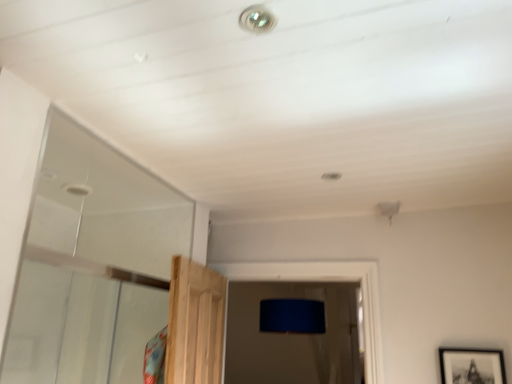
Question: In the image, is black matte picture frame at lower right on the left side or the right side of metallic droplight at upper center?

Choices:
 (A) right
 (B) left

Answer: (A)

Question: Does point (446, 349) appear closer or farther from the camera than point (272, 23)?

Choices:
 (A) farther
 (B) closer

Answer: (A)

Question: In terms of height, does black matte picture frame at lower right look taller or shorter compared to metallic droplight at upper center?

Choices:
 (A) tall
 (B) short

Answer: (A)

Question: Is point (x=251, y=26) positioned closer to the camera than point (x=480, y=382)?

Choices:
 (A) farther
 (B) closer

Answer: (B)

Question: From a real-world perspective, is metallic droplight at upper center positioned above or below black matte picture frame at lower right?

Choices:
 (A) above
 (B) below

Answer: (A)

Question: In the image, is metallic droplight at upper center on the left side or the right side of black matte picture frame at lower right?

Choices:
 (A) left
 (B) right

Answer: (A)

Question: Is metallic droplight at upper center in front of or behind black matte picture frame at lower right in the image?

Choices:
 (A) behind
 (B) front

Answer: (B)